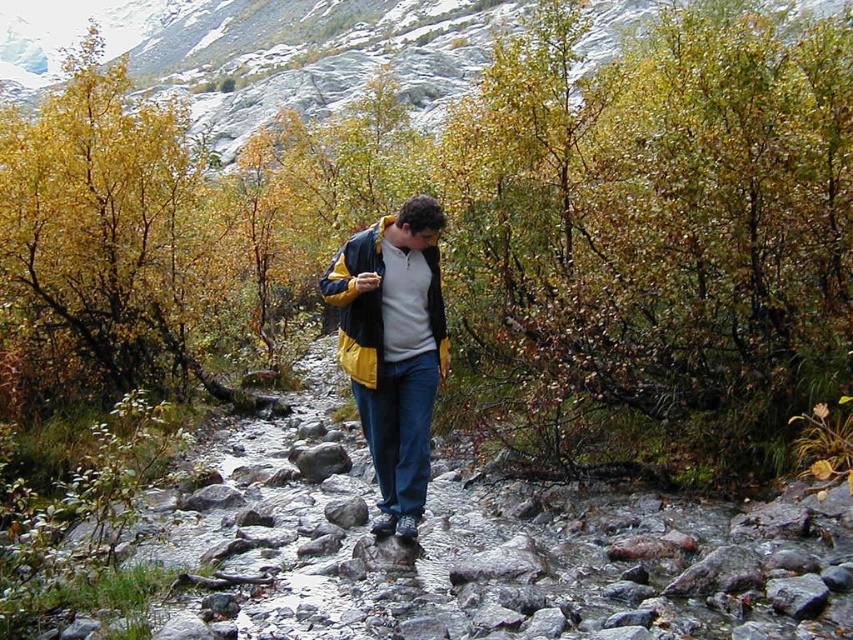
You are a hiker trying to decide whether to take a photo of the rocky gray mountain at upper center and the yellow matte jacket at center. Since you want the mountain to appear bigger in the photo than the jacket, which object should you focus on?

The rocky gray mountain at upper center is larger in size than the yellow matte jacket at center, so you should focus on the rocky gray mountain at upper center to make it appear bigger in the photo.

You are a hiker trying to navigate to the rocky gray mountain at upper center. Based on the coordinates provided, can you determine if it is positioned in the upper half of the image?

The rocky gray mountain at upper center is located at point (302, 54), which falls within the upper half of the image since the y coordinate is less than 0.5. Therefore, it is positioned in the upper half.

Consider the image. You are planning to take a photo of the rocky gray mountain at upper center and the yellow matte jacket at center. Which object should be focused on first if you want to ensure both are in sharp focus?

The rocky gray mountain at upper center should be focused on first because it is taller than the yellow matte jacket at center, so focusing on the taller object first helps ensure both are in sharp focus.